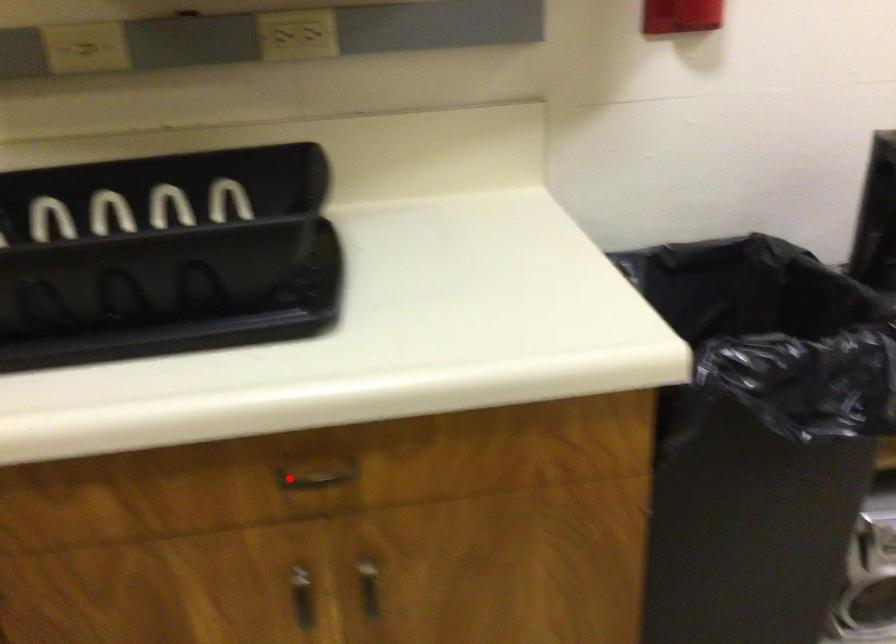
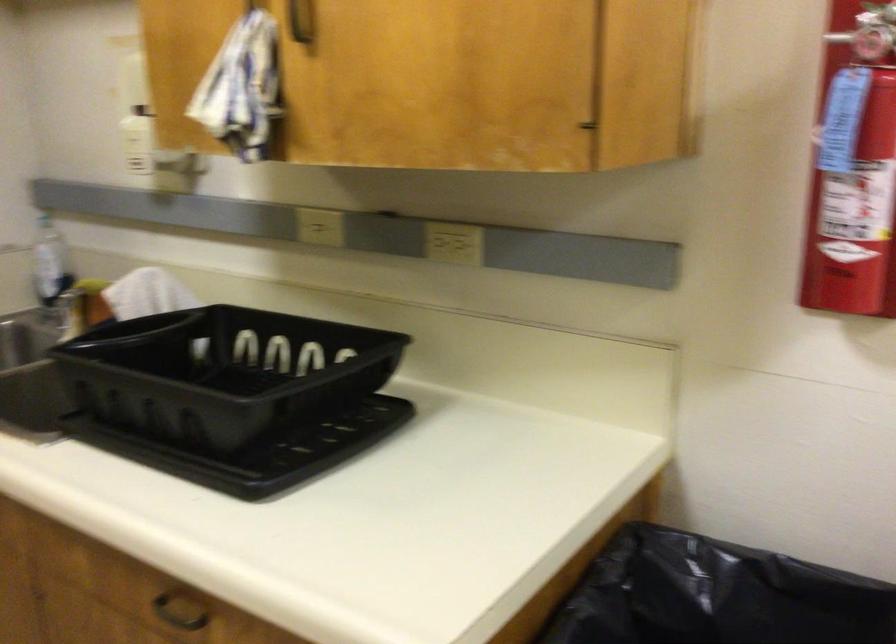
Find the pixel in the second image that matches the highlighted location in the first image.

(178, 611)